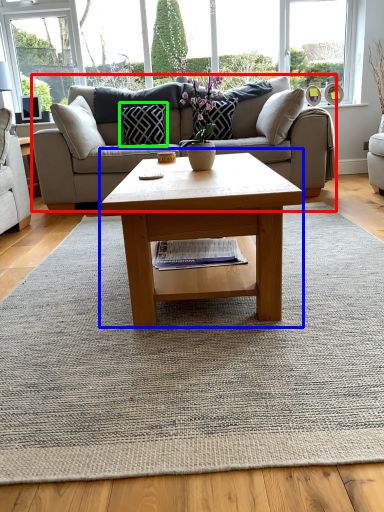
Question: Estimate the real-world distances between objects in this image. Which object is closer to studio couch (highlighted by a red box), coffee table (highlighted by a blue box) or pillow (highlighted by a green box)?

Choices:
 (A) coffee table
 (B) pillow

Answer: (B)